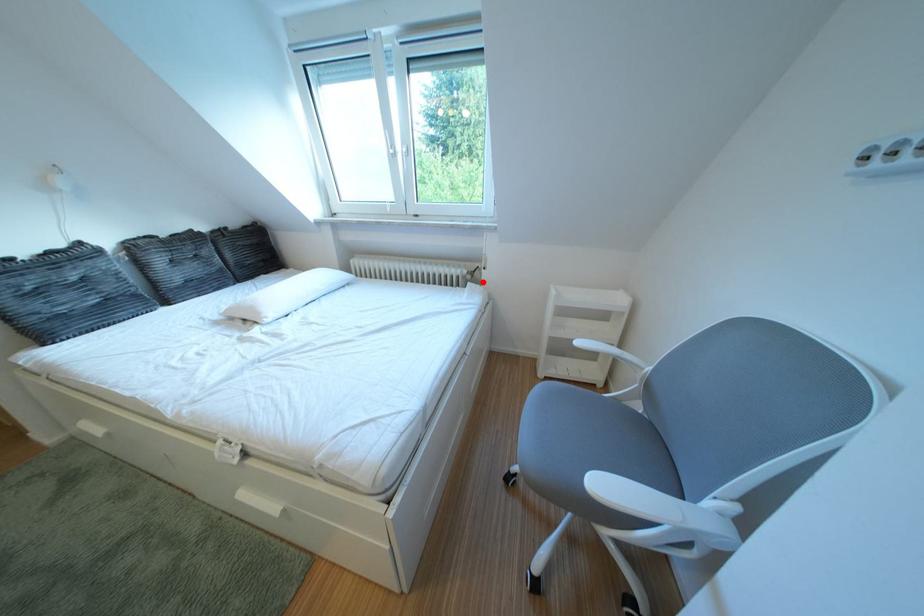
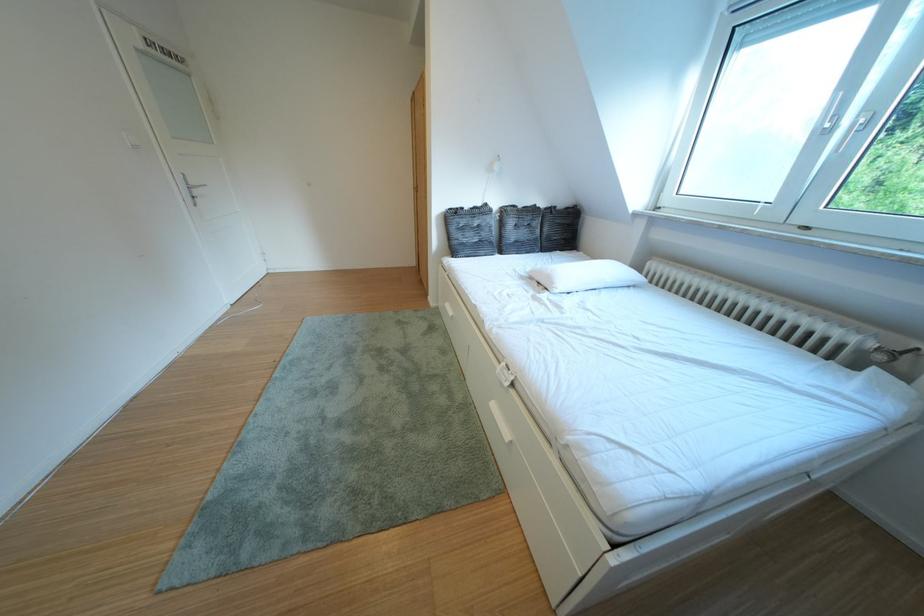
Question: I am providing you with two images of the same scene from different viewpoints. A red point is shown in image1. For the corresponding object point in image2, is it positioned nearer or farther from the camera?

Choices:
 (A) Nearer
 (B) Farther

Answer: (B)